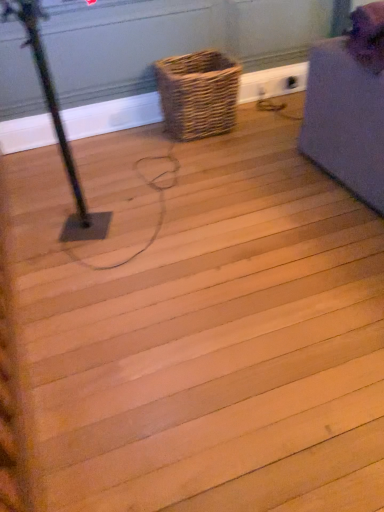
Identify the location of vacant area situated to the left side of woven brown basket at center. (125, 143).